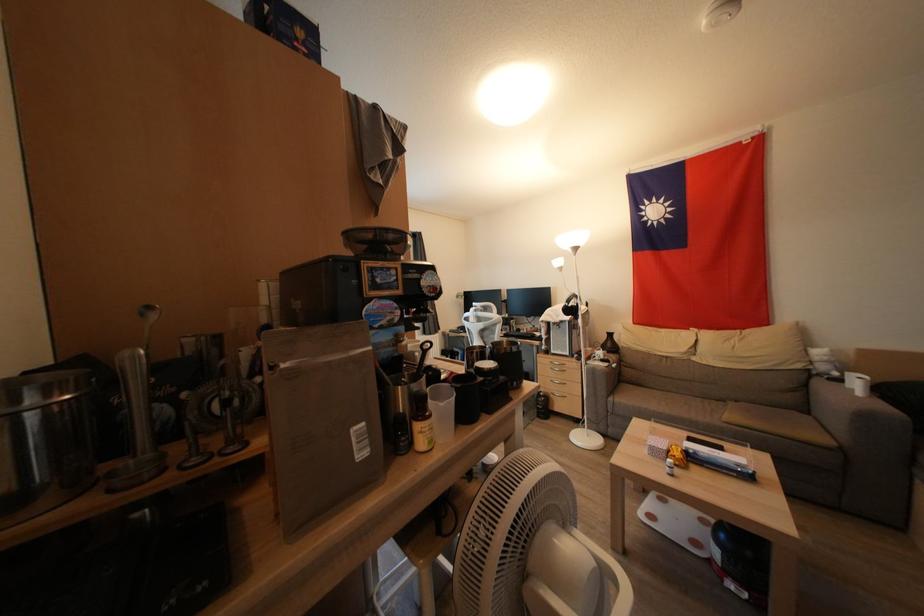
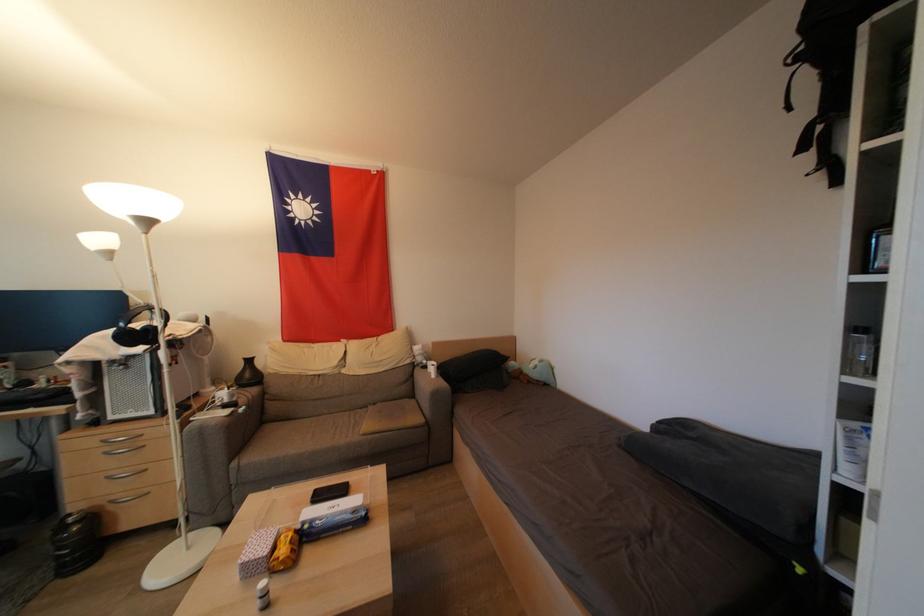
Where in the second image is the point corresponding to [813,378] from the first image?

(418, 370)